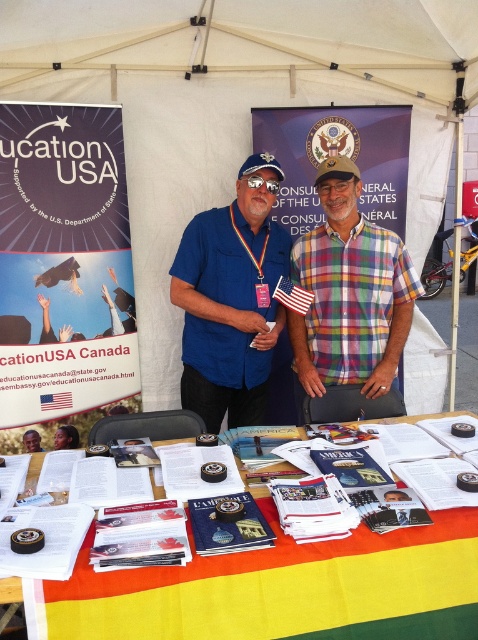
Between paper brochures at center and smooth plastic photo frame at center, which one has more height?

Standing taller between the two is paper brochures at center.

Is point (80, 611) more distant than point (66, 424)?

No, it is in front of (66, 424).

What do you see at coordinates (274, 586) in the screenshot?
I see `paper brochures at center` at bounding box center [274, 586].

Find the location of `paper brochures at center`. paper brochures at center is located at coordinates (274, 586).

In the scene shown: Which is more to the right, matte blue shirt at center or smooth skin face at center?

matte blue shirt at center

Between matte blue shirt at center and smooth skin face at center, which one has more height?

matte blue shirt at center is taller.

I want to click on matte blue shirt at center, so click(x=231, y=300).

The height and width of the screenshot is (640, 478). In order to click on matte blue shirt at center in this screenshot , I will do `click(231, 300)`.

Is paper brochures at center shorter than smooth skin face at center?

In fact, paper brochures at center may be taller than smooth skin face at center.

Who is lower down, paper brochures at center or smooth skin face at center?

smooth skin face at center is below.

Where is `paper brochures at center`? The width and height of the screenshot is (478, 640). paper brochures at center is located at coordinates (274, 586).